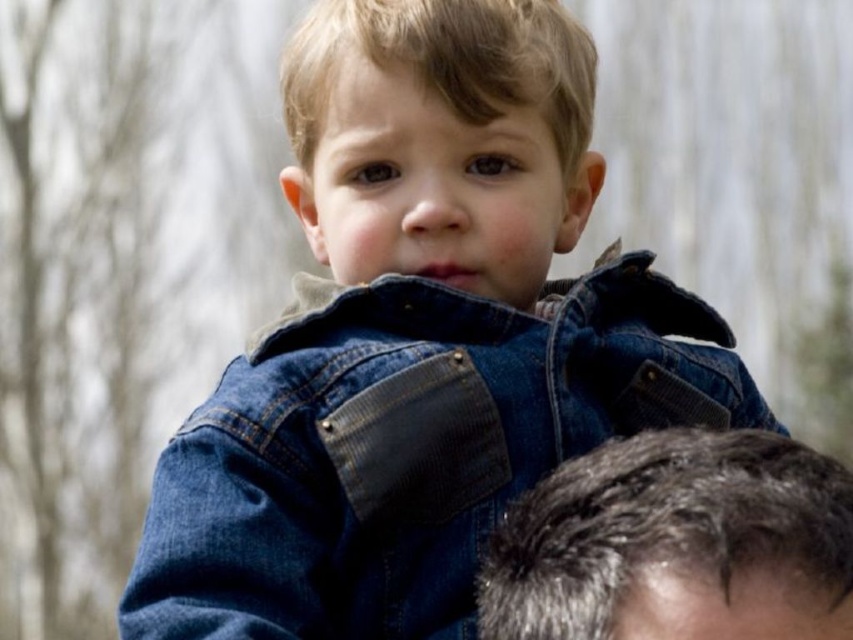
Is denim jacket at center thinner than gray hair at upper right?

In fact, denim jacket at center might be wider than gray hair at upper right.

Which is behind, point (167, 518) or point (767, 433)?

The point (167, 518) is behind.

This screenshot has width=853, height=640. I want to click on denim jacket at center, so 407,448.

Where is `denim jacket at center`? The image size is (853, 640). denim jacket at center is located at coordinates (407, 448).